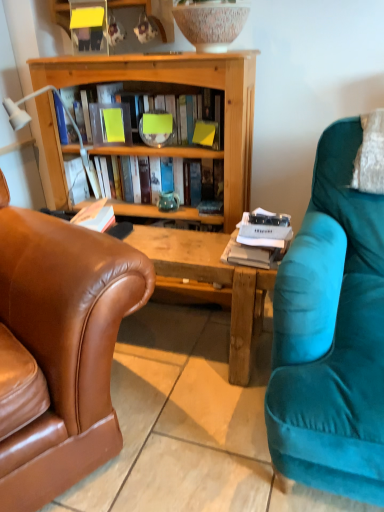
Question: From the image's perspective, relative to white plastic lamp at left, is wooden book at center, acting as the 2th book starting from the top, above or below?

Choices:
 (A) below
 (B) above

Answer: (A)

Question: Considering the positions of point (140, 197) and point (72, 118), is point (140, 197) closer or farther from the camera than point (72, 118)?

Choices:
 (A) closer
 (B) farther

Answer: (B)

Question: Which object is positioned closest to the white plastic lamp at left?

Choices:
 (A) brown leather chair at left
 (B) yellow paper at center
 (C) matte yellow book at center, which appears as the 2th book when ordered from the bottom
 (D) teal ceramic vase at center
 (E) wooden book at center, acting as the 2th book starting from the top

Answer: (B)

Question: Which object is positioned farthest from the matte yellow book at center, the first book positioned from the top?

Choices:
 (A) white plastic lamp at left
 (B) brown leather chair at left
 (C) wooden book at center, which is the 1th book from bottom to top
 (D) yellow paper at center
 (E) teal ceramic vase at center

Answer: (B)